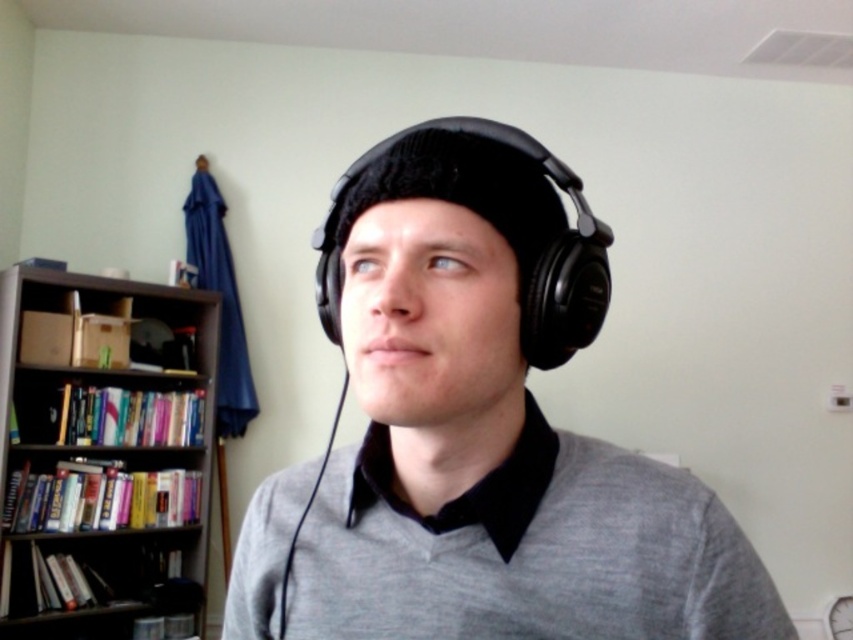
You are an interior designer planning to hang a decorative painting on the wall in this room. The painting is 1 meter wide. The gray cotton sweater at center is currently positioned at point 0.863 on the horizontal axis and 0.620 on the vertical axis. To ensure the painting is centered above the bookshelf, which is located below the blue umbrella hanging on the wall, where should you place the center of the painting?

The center of the painting should be placed at the midpoint between the bookshelf and the blue umbrella. Since the gray cotton sweater at center is at point 0.863 horizontally and 0.620 vertically, the bookshelf is below the blue umbrella. The midpoint would be halfway between their vertical positions, ensuring the painting is centered above the bookshelf.

You are a delivery person who needs to place a small package between the matte black headphones at center and the dark wood bookcase at left. The package is 2 meters long. Will it fit in the space between them?

The distance between the matte black headphones at center and the dark wood bookcase at left is 2.35 meters. Since the package is 2 meters long, it will fit in the space between them as the distance is greater than the package length.

You are trying to decide whether to place a new tall plant next to the gray cotton sweater at center or the dark wood bookcase at left. Based on their heights, which location would allow the plant to fit better without exceeding the height of the object it is placed next to?

The gray cotton sweater at center is not as tall as the dark wood bookcase at left, so placing the plant next to the bookcase would allow it to be taller and still fit better.